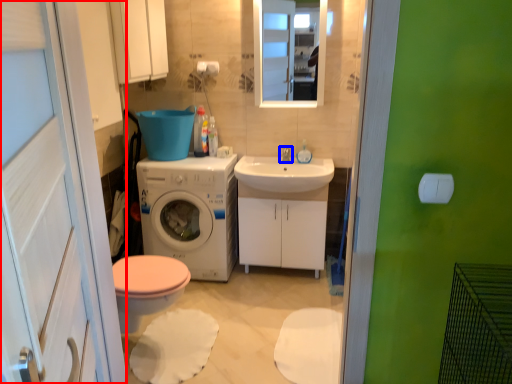
Question: Which point is further to the camera, screen door (highlighted by a red box) or tap (highlighted by a blue box)?

Choices:
 (A) screen door
 (B) tap

Answer: (B)